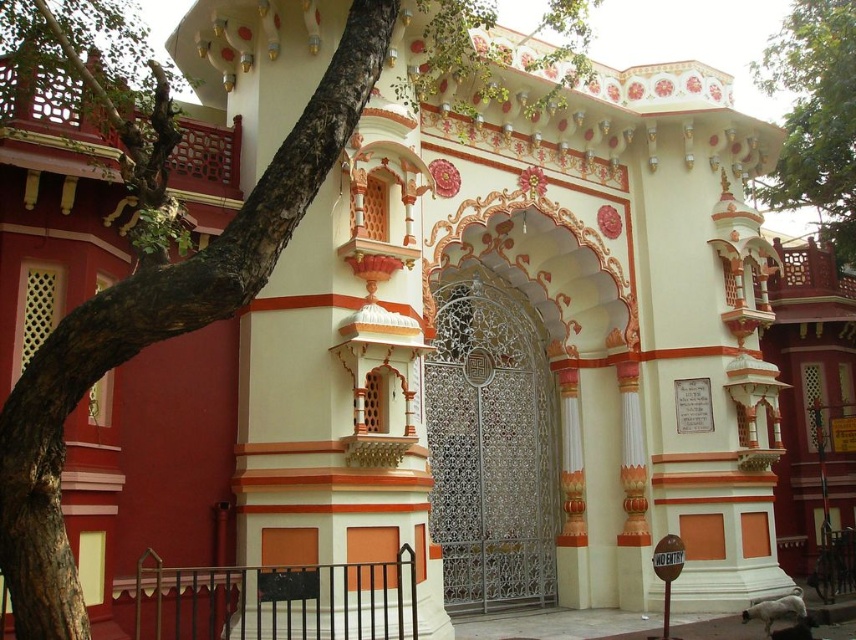
Question: Is brown rough bark at center left bigger than green leafy tree at upper right?

Choices:
 (A) no
 (B) yes

Answer: (A)

Question: Which of these objects is positioned closest to the green leafy tree at upper right?

Choices:
 (A) brown rough bark at center left
 (B) white metal gate at center

Answer: (B)

Question: Does white metal gate at center lie behind green leafy tree at upper right?

Choices:
 (A) no
 (B) yes

Answer: (A)

Question: Which point is closer to the camera?

Choices:
 (A) white metal gate at center
 (B) brown rough bark at center left
 (C) green leafy tree at upper right

Answer: (B)

Question: Can you confirm if brown rough bark at center left is positioned to the left of green leafy tree at upper right?

Choices:
 (A) yes
 (B) no

Answer: (A)

Question: Which object appears closest to the camera in this image?

Choices:
 (A) white metal gate at center
 (B) green leafy tree at upper right
 (C) brown rough bark at center left

Answer: (C)